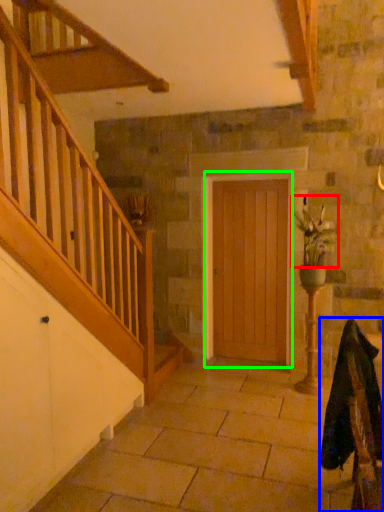
Question: Which object is positioned closest to floral arrangement (highlighted by a red box)? Select from rocking chair (highlighted by a blue box) and door (highlighted by a green box).

Choices:
 (A) rocking chair
 (B) door

Answer: (B)